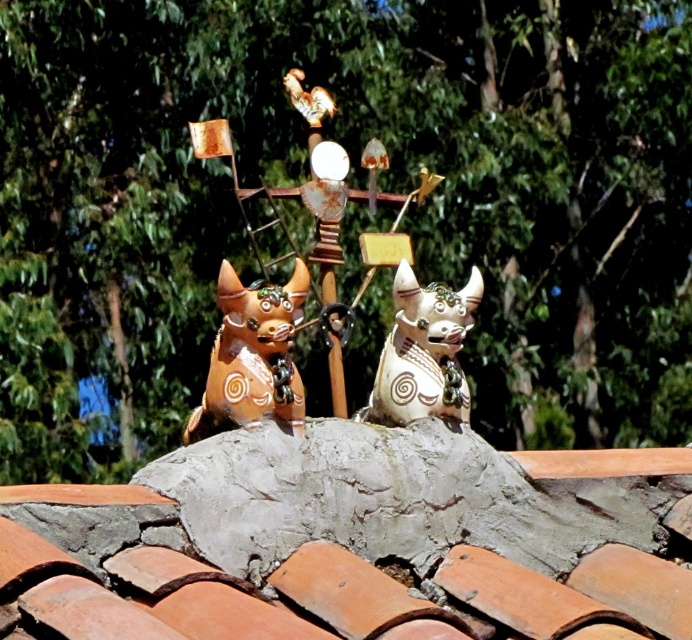
Is matte ceramic dogs at center above matte ceramic dog at center?

Indeed, matte ceramic dogs at center is positioned over matte ceramic dog at center.

Which is below, matte ceramic dogs at center or matte ceramic dog at center?

matte ceramic dog at center is lower down.

Where is `matte ceramic dogs at center`? The height and width of the screenshot is (640, 692). matte ceramic dogs at center is located at coordinates (392, 289).

What are the coordinates of `matte ceramic dogs at center` in the screenshot? It's located at (392, 289).

Who is positioned more to the left, matte ceramic dogs at center or matte orange statue at center?

matte orange statue at center is more to the left.

Does matte ceramic dogs at center have a lesser width compared to matte orange statue at center?

Incorrect, matte ceramic dogs at center's width is not less than matte orange statue at center's.

Which is behind, point (320, 266) or point (260, 310)?

Point (320, 266)

Locate an element on the screen. Image resolution: width=692 pixels, height=640 pixels. matte ceramic dogs at center is located at coordinates (392, 289).

Which is below, terracotta tiles at center or matte ceramic dogs at center?

Positioned lower is terracotta tiles at center.

Can you confirm if terracotta tiles at center is positioned to the right of matte ceramic dogs at center?

Yes, terracotta tiles at center is to the right of matte ceramic dogs at center.

Between point (227, 636) and point (421, 168), which one is positioned behind?

Point (421, 168)

Locate an element on the screen. Image resolution: width=692 pixels, height=640 pixels. terracotta tiles at center is located at coordinates (355, 541).